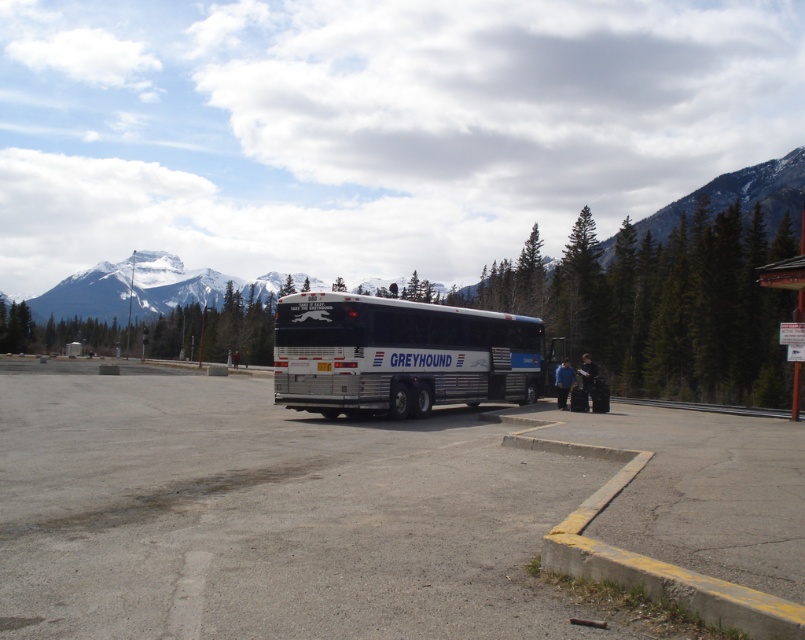
You are a delivery person who needs to place a large package on the gray asphalt parking lot at center. However, you notice the black leather jacket at lower center nearby. Considering their heights, which object can you place the package on without it falling over?

The gray asphalt parking lot at center has a lesser height compared to the black leather jacket at lower center, so placing the package on the gray asphalt parking lot at center would be more stable as it is flatter and lower to the ground, preventing it from tipping over.

You are a traveler who just arrived at the rest area and need to store your black leather jacket at lower center. The gray asphalt parking lot at center is available. Can you fit your jacket there?

The gray asphalt parking lot at center occupies less space than the black leather jacket at lower center, so it cannot accommodate the jacket.